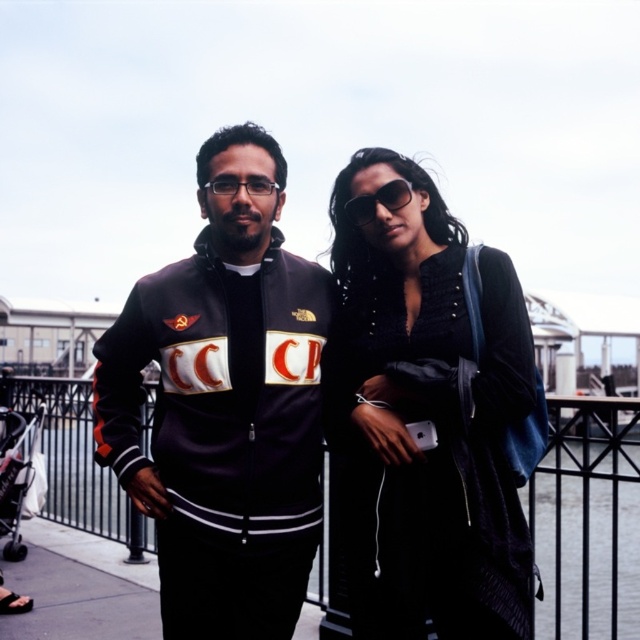
Does point (225, 378) come closer to viewer compared to point (388, 202)?

Yes, it is in front of point (388, 202).

Where is `dark blue leather jacket at center`? Image resolution: width=640 pixels, height=640 pixels. dark blue leather jacket at center is located at coordinates (224, 406).

Can you confirm if dark blue leather jacket at center is shorter than clear plastic glasses at center?

No.

Does dark blue leather jacket at center appear on the left side of clear plastic glasses at center?

Incorrect, dark blue leather jacket at center is not on the left side of clear plastic glasses at center.

Identify the location of dark blue leather jacket at center. The width and height of the screenshot is (640, 640). (224, 406).

The image size is (640, 640). Identify the location of dark blue leather jacket at center. (224, 406).

Can you confirm if black velvet dress at center is positioned to the left of dark blue leather jacket at center?

In fact, black velvet dress at center is to the right of dark blue leather jacket at center.

Does black velvet dress at center have a larger size compared to dark blue leather jacket at center?

Indeed, black velvet dress at center has a larger size compared to dark blue leather jacket at center.

Locate an element on the screen. Image resolution: width=640 pixels, height=640 pixels. black velvet dress at center is located at coordinates (426, 417).